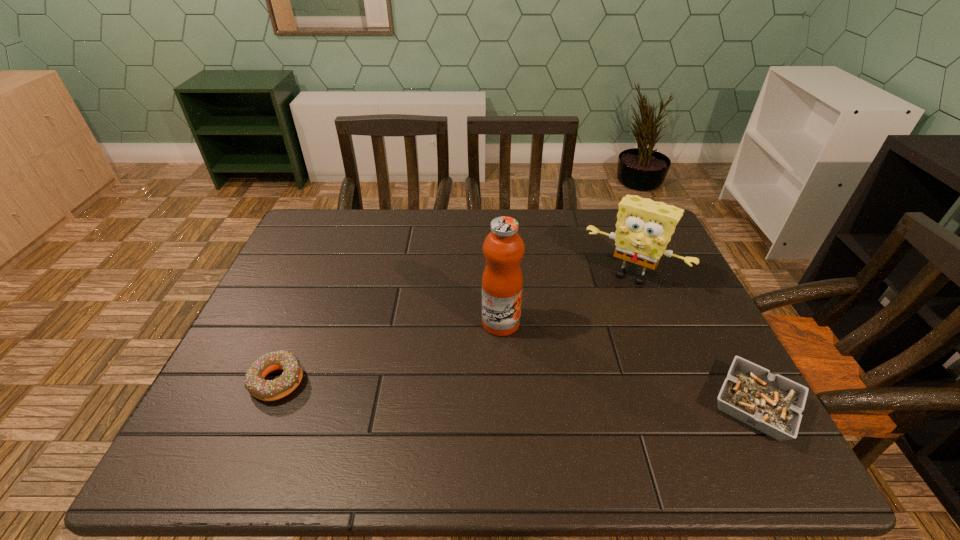
This screenshot has width=960, height=540. I want to click on vacant area between the third object from right to left and the ashtray, so click(628, 364).

Where is `unoccupied area between the doughnut and the second object from left to right`? The height and width of the screenshot is (540, 960). unoccupied area between the doughnut and the second object from left to right is located at coordinates (389, 352).

Identify the location of free spot between the leftmost object and the second tallest object. (454, 328).

Locate an element on the screen. The image size is (960, 540). vacant space that is in between the ashtray and the sponge is located at coordinates (693, 340).

Locate an element on the screen. The height and width of the screenshot is (540, 960). vacant point located between the ashtray and the sponge is located at coordinates [x=693, y=340].

This screenshot has width=960, height=540. Find the location of `free spot between the leftmost object and the fruit juice`. free spot between the leftmost object and the fruit juice is located at coordinates (389, 352).

Where is `empty location between the sponge and the second farthest object`? This screenshot has height=540, width=960. empty location between the sponge and the second farthest object is located at coordinates (566, 299).

Identify which object is located as the nearest to the fruit juice. Please provide its 2D coordinates. Your answer should be formatted as a tuple, i.e. [(x, y)], where the tuple contains the x and y coordinates of a point satisfying the conditions above.

[(644, 227)]

What are the coordinates of `object that can be found as the second closest to the leftmost object` in the screenshot? It's located at (644, 227).

The image size is (960, 540). What are the coordinates of `blank area in the image that satisfies the following two spatial constraints: 1. on the front side of the ashtray; 2. on the left side of the leftmost object` in the screenshot? It's located at (267, 406).